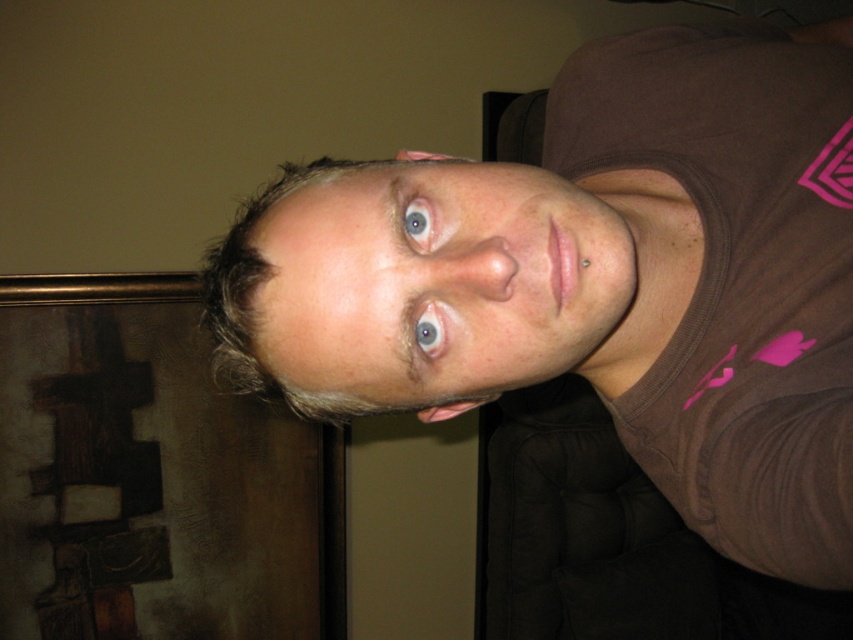
You are a photographer adjusting lighting for a portrait. You need to ensure that the pale skin at center and blue matte eye at center are both well lit. Given their sizes, which area requires a wider light source to cover adequately?

The pale skin at center requires a wider light source because its width is larger than the blue matte eye at center.

From the picture: You are an interior designer assessing the visual balance of the scene. Considering the brown cotton shirt at upper center and the blue matte eye at upper center, which object would you adjust to improve symmetry?

The blue matte eye at upper center has a smaller width compared to the brown cotton shirt at upper center. To improve symmetry, you could adjust the blue matte eye at upper center to match the width of the brown cotton shirt at upper center.